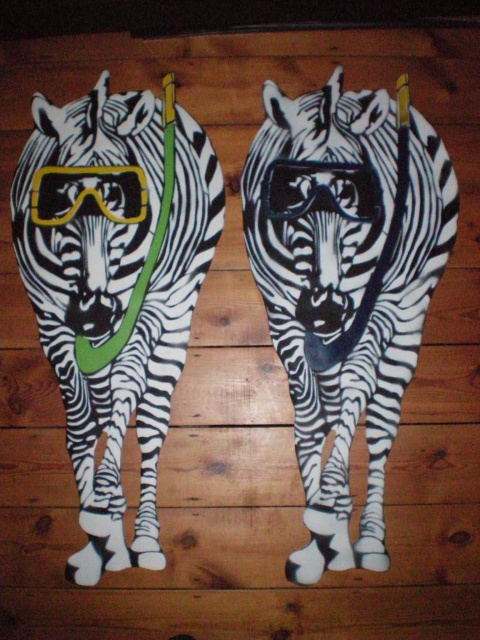
Is point (66, 428) behind point (87, 188)?

No, it is not.

Between point (170, 150) and point (96, 192), which one is positioned behind?

Point (170, 150)

Who is more distant from viewer, (131, 173) or (115, 170)?

Positioned behind is point (131, 173).

Find the location of a particular element. The height and width of the screenshot is (640, 480). matte black zebra at left is located at coordinates (116, 288).

Who is more forward, (275, 140) or (152, 168)?

Point (152, 168) is in front.

Which is in front, point (344, 438) or point (91, 179)?

Positioned in front is point (344, 438).

Find the location of a particular element. matte black zebra at center is located at coordinates (346, 285).

Does matte black zebra at center come behind black matte goggles at center?

No, it is in front of black matte goggles at center.

Does matte black zebra at center appear under black matte goggles at center?

Yes, matte black zebra at center is below black matte goggles at center.

Is point (411, 227) more distant than point (351, 170)?

That is False.

Locate an element on the screen. matte black zebra at center is located at coordinates (346, 285).